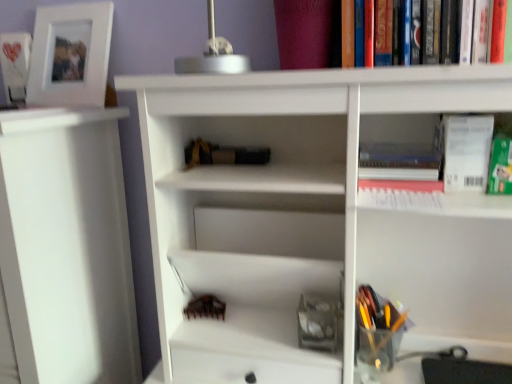
Question: Can you confirm if hardcover book at upper right, which ranks as the 1th book in right-to-left order, is thinner than translucent plastic pen holder at lower right?

Choices:
 (A) yes
 (B) no

Answer: (A)

Question: Is translucent plastic pen holder at lower right at the back of hardcover book at upper right, the 3th book viewed from the back?

Choices:
 (A) yes
 (B) no

Answer: (B)

Question: Is hardcover book at upper right, which is the first book from bottom to top, at the left side of translucent plastic pen holder at lower right?

Choices:
 (A) yes
 (B) no

Answer: (B)

Question: Does hardcover book at upper right, which is the third book from left to right, have a greater width compared to translucent plastic pen holder at lower right?

Choices:
 (A) no
 (B) yes

Answer: (A)

Question: Would you consider hardcover book at upper right, which ranks as the 1th book in right-to-left order, to be distant from translucent plastic pen holder at lower right?

Choices:
 (A) yes
 (B) no

Answer: (B)

Question: Would you say hardcover book at upper right, acting as the first book starting from the front, is inside or outside black matte book at center, which is the second book from top to bottom?

Choices:
 (A) inside
 (B) outside

Answer: (B)

Question: Is hardcover book at upper right, acting as the first book starting from the front, to the left or to the right of black matte book at center, the 2th book positioned from the front, in the image?

Choices:
 (A) right
 (B) left

Answer: (A)

Question: Is point (368, 142) closer or farther from the camera than point (241, 150)?

Choices:
 (A) closer
 (B) farther

Answer: (A)

Question: From a real-world perspective, is hardcover book at upper right, acting as the first book starting from the front, above or below black matte book at center, which appears as the 2th book when viewed from the back?

Choices:
 (A) above
 (B) below

Answer: (B)

Question: From the image's perspective, is translucent plastic pen holder at lower right positioned above or below white matte shelf at left?

Choices:
 (A) above
 (B) below

Answer: (B)

Question: Is translucent plastic pen holder at lower right taller or shorter than white matte shelf at left?

Choices:
 (A) short
 (B) tall

Answer: (A)

Question: From a real-world perspective, relative to white matte shelf at left, is translucent plastic pen holder at lower right vertically above or below?

Choices:
 (A) above
 (B) below

Answer: (B)

Question: Which is correct: translucent plastic pen holder at lower right is inside white matte shelf at left, or outside of it?

Choices:
 (A) outside
 (B) inside

Answer: (A)

Question: Is white matte picture frame at upper left spatially inside translucent plastic pen holder at lower right, or outside of it?

Choices:
 (A) outside
 (B) inside

Answer: (A)

Question: In terms of size, does white matte picture frame at upper left appear bigger or smaller than translucent plastic pen holder at lower right?

Choices:
 (A) big
 (B) small

Answer: (A)